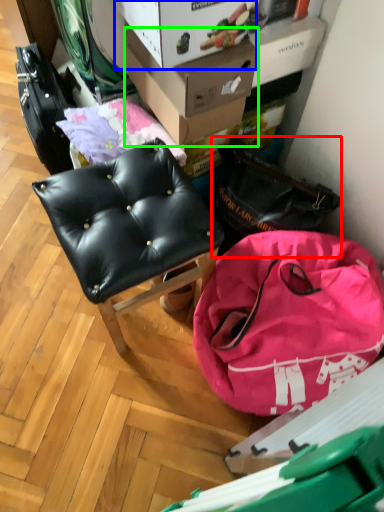
Question: Considering the real-world distances, which object is farthest from messenger bag (highlighted by a red box)? cardboard box (highlighted by a blue box) or cardboard box (highlighted by a green box)?

Choices:
 (A) cardboard box
 (B) cardboard box

Answer: (A)